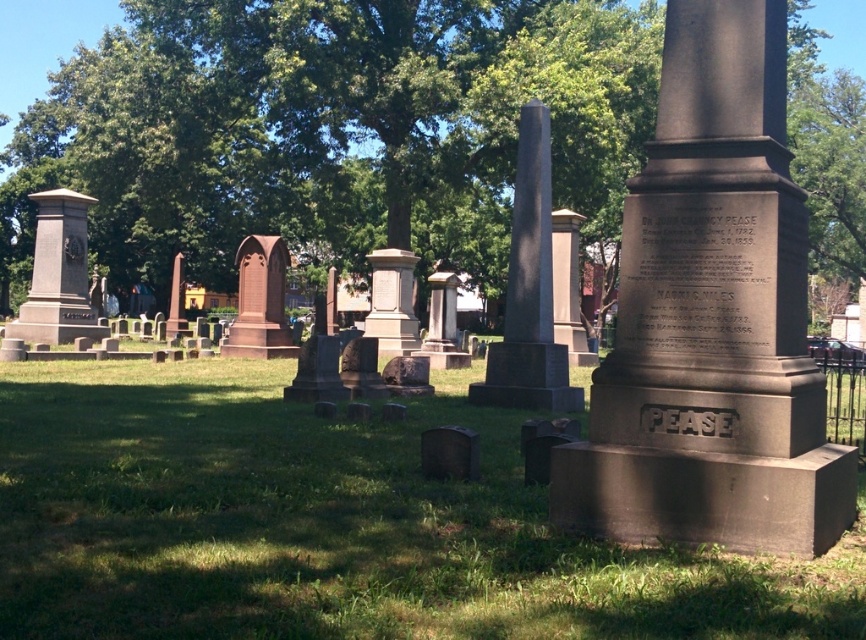
Question: Is dark brown stone monument at center to the left of gray stone obelisk at center from the viewer's perspective?

Choices:
 (A) yes
 (B) no

Answer: (A)

Question: Which point appears closest to the camera in this image?

Choices:
 (A) click(x=772, y=134)
 (B) click(x=263, y=250)

Answer: (A)

Question: Does brown stone monument at left appear under brown stone monument at center?

Choices:
 (A) yes
 (B) no

Answer: (B)

Question: Which point is closer to the camera taking this photo?

Choices:
 (A) (469, 476)
 (B) (544, 310)
 (C) (279, 266)

Answer: (A)

Question: Is green grass at center wider than green stone gravestone at center?

Choices:
 (A) yes
 (B) no

Answer: (A)

Question: Estimate the real-world distances between objects in this image. Which object is farther from the brown stone monument at center?

Choices:
 (A) gray stone obelisk at center
 (B) brown stone monument at left

Answer: (A)